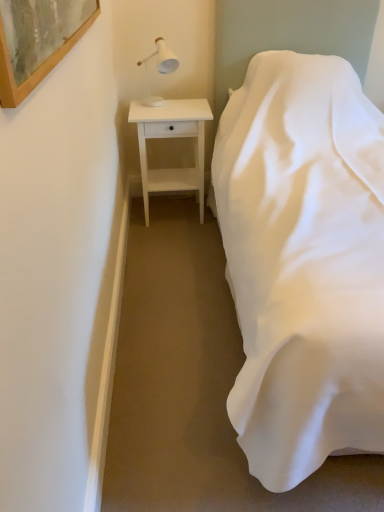
Question: Considering the relative sizes of white wood nightstand at left and white matte table lamp at upper left in the image provided, is white wood nightstand at left bigger than white matte table lamp at upper left?

Choices:
 (A) no
 (B) yes

Answer: (B)

Question: From the image's perspective, is white wood nightstand at left over white matte table lamp at upper left?

Choices:
 (A) no
 (B) yes

Answer: (A)

Question: Is white wood nightstand at left outside white matte table lamp at upper left?

Choices:
 (A) yes
 (B) no

Answer: (A)

Question: From the image's perspective, is white wood nightstand at left below white matte table lamp at upper left?

Choices:
 (A) no
 (B) yes

Answer: (B)

Question: Does white wood nightstand at left have a greater height compared to white matte table lamp at upper left?

Choices:
 (A) no
 (B) yes

Answer: (B)

Question: Is white wood nightstand at left positioned in front of white matte table lamp at upper left?

Choices:
 (A) no
 (B) yes

Answer: (A)

Question: Considering the relative sizes of wooden-framed artwork at upper left and white matte table lamp at upper left in the image provided, is wooden-framed artwork at upper left wider than white matte table lamp at upper left?

Choices:
 (A) yes
 (B) no

Answer: (B)

Question: Considering the relative positions of wooden-framed artwork at upper left and white matte table lamp at upper left in the image provided, is wooden-framed artwork at upper left to the left of white matte table lamp at upper left from the viewer's perspective?

Choices:
 (A) no
 (B) yes

Answer: (B)

Question: Can you confirm if wooden-framed artwork at upper left is positioned to the right of white matte table lamp at upper left?

Choices:
 (A) yes
 (B) no

Answer: (B)

Question: From a real-world perspective, is wooden-framed artwork at upper left positioned over white matte table lamp at upper left based on gravity?

Choices:
 (A) yes
 (B) no

Answer: (A)

Question: Can you confirm if wooden-framed artwork at upper left is taller than white matte table lamp at upper left?

Choices:
 (A) no
 (B) yes

Answer: (A)

Question: Is wooden-framed artwork at upper left not near white matte table lamp at upper left?

Choices:
 (A) no
 (B) yes

Answer: (B)

Question: From the image's perspective, does white satin bed at right appear lower than white wood nightstand at left?

Choices:
 (A) no
 (B) yes

Answer: (B)